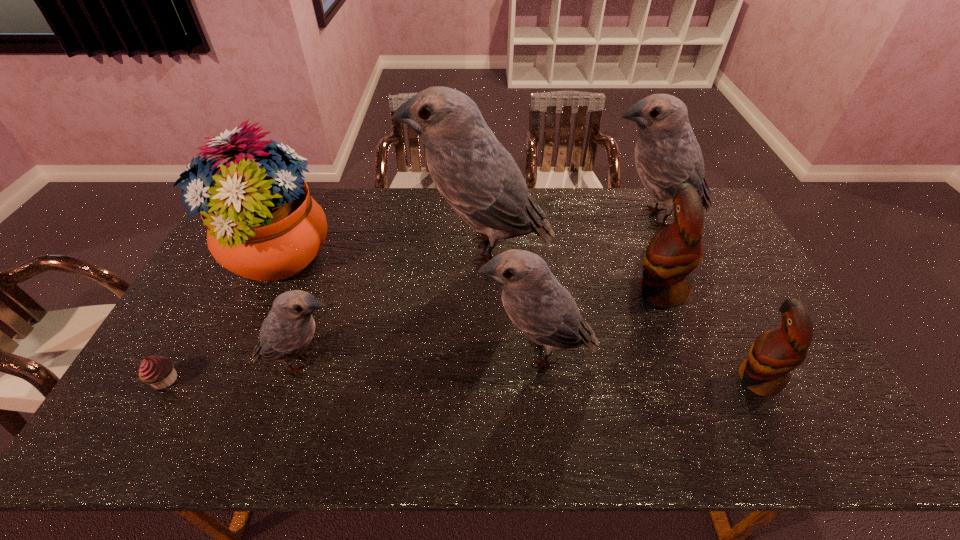
In the image, there is a desktop. Where is `vacant space at the right edge`? The height and width of the screenshot is (540, 960). vacant space at the right edge is located at coordinates (792, 400).

What are the coordinates of `vacant space at the near left corner of the desktop` in the screenshot? It's located at (150, 424).

The image size is (960, 540). What are the coordinates of `free space at the far right corner of the desktop` in the screenshot? It's located at (673, 217).

Where is `unoccupied position between the third smallest gray parrot and the flower arrangement`? unoccupied position between the third smallest gray parrot and the flower arrangement is located at coordinates (464, 239).

This screenshot has width=960, height=540. What are the coordinates of `vacant area that lies between the tallest object and the second biggest gray parrot` in the screenshot? It's located at (566, 234).

Image resolution: width=960 pixels, height=540 pixels. I want to click on empty space that is in between the leftmost parrot and the second smallest gray parrot, so click(420, 358).

Where is `blank region between the tallest parrot and the leftmost parrot`? blank region between the tallest parrot and the leftmost parrot is located at coordinates (392, 307).

The image size is (960, 540). Identify the location of vacant region between the tallest object and the nearer red parrot. (619, 314).

I want to click on empty space that is in between the third smallest gray parrot and the third biggest gray parrot, so click(x=594, y=286).

The width and height of the screenshot is (960, 540). Identify the location of free space between the smallest gray parrot and the pink cupcake. (x=233, y=372).